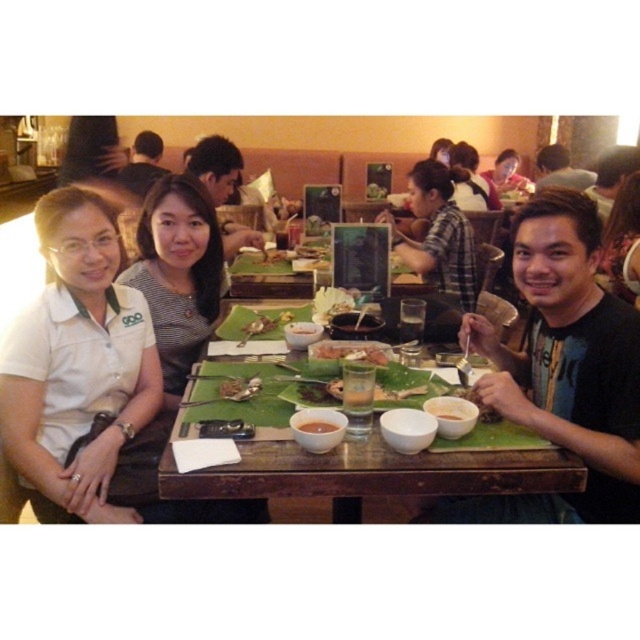
Question: Is plaid shirt at center positioned behind brown matte rice at center?

Choices:
 (A) yes
 (B) no

Answer: (A)

Question: Which object appears closest to the camera in this image?

Choices:
 (A) brown matte rice at center
 (B) white shirt at center
 (C) slightly browned rice at center
 (D) matte pink shirt at upper center

Answer: (A)

Question: Is black matte shirt at center closer to the viewer compared to matte black shirt at center?

Choices:
 (A) yes
 (B) no

Answer: (A)

Question: Does black matte shirt at center lie behind wooden table at center?

Choices:
 (A) yes
 (B) no

Answer: (A)

Question: Which object is farther from the camera taking this photo?

Choices:
 (A) white shirt at center
 (B) matte black shirt at center

Answer: (B)

Question: Among these points, which one is farthest from the camera?

Choices:
 (A) (154, 156)
 (B) (269, 470)
 (C) (301, 326)
 (D) (346, 122)

Answer: (D)